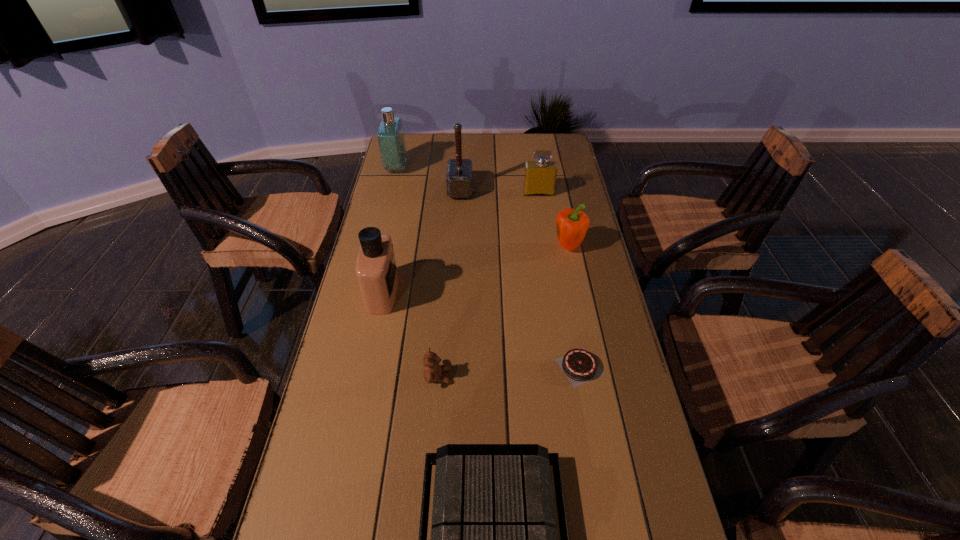
Locate an element on the screen. Image resolution: width=960 pixels, height=540 pixels. unoccupied area between the chocolate cake and the fourth farthest object is located at coordinates 574,307.

Where is `the fifth closest object to the rightmost perfume`? the fifth closest object to the rightmost perfume is located at coordinates (580, 366).

The width and height of the screenshot is (960, 540). What are the coordinates of `object that is the third closest to the fifth nearest object` in the screenshot? It's located at (580, 366).

The height and width of the screenshot is (540, 960). I want to click on perfume that stands as the closest to the fifth farthest object, so click(390, 135).

Where is `perfume that can be found as the closest to the shortest perfume`? perfume that can be found as the closest to the shortest perfume is located at coordinates (390, 135).

The width and height of the screenshot is (960, 540). I want to click on free location that satisfies the following two spatial constraints: 1. on the front side of the hammer; 2. on the face of the teddy bear, so click(450, 376).

You are a GUI agent. You are given a task and a screenshot of the screen. Output one action in this format:
    pyautogui.click(x=<x>, y=<y>)
    Task: Click on the free space that satisfies the following two spatial constraints: 1. on the front side of the hammer; 2. on the left side of the shortest object
    This screenshot has height=540, width=960.
    Given the screenshot: What is the action you would take?
    pyautogui.click(x=451, y=367)

Locate an element on the screen. The image size is (960, 540). free location that satisfies the following two spatial constraints: 1. on the back side of the shortest object; 2. on the front label of the fourth nearest object is located at coordinates (565, 293).

Where is `free space that satisfies the following two spatial constraints: 1. on the front side of the pepper; 2. on the front label of the nearest perfume`? Image resolution: width=960 pixels, height=540 pixels. free space that satisfies the following two spatial constraints: 1. on the front side of the pepper; 2. on the front label of the nearest perfume is located at coordinates (578, 293).

Locate an element on the screen. The image size is (960, 540). free space that satisfies the following two spatial constraints: 1. on the front label of the hammer; 2. on the right side of the farthest object is located at coordinates (391, 190).